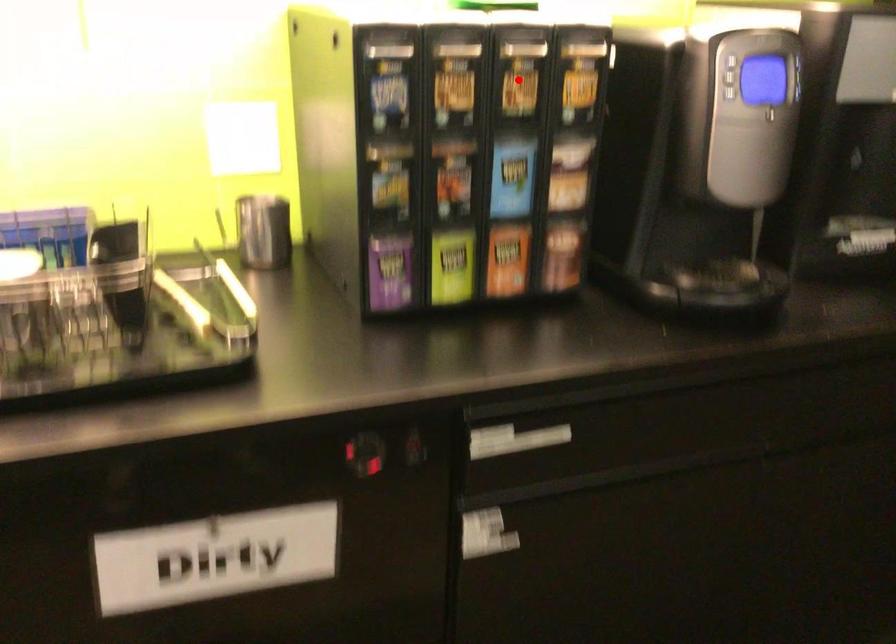
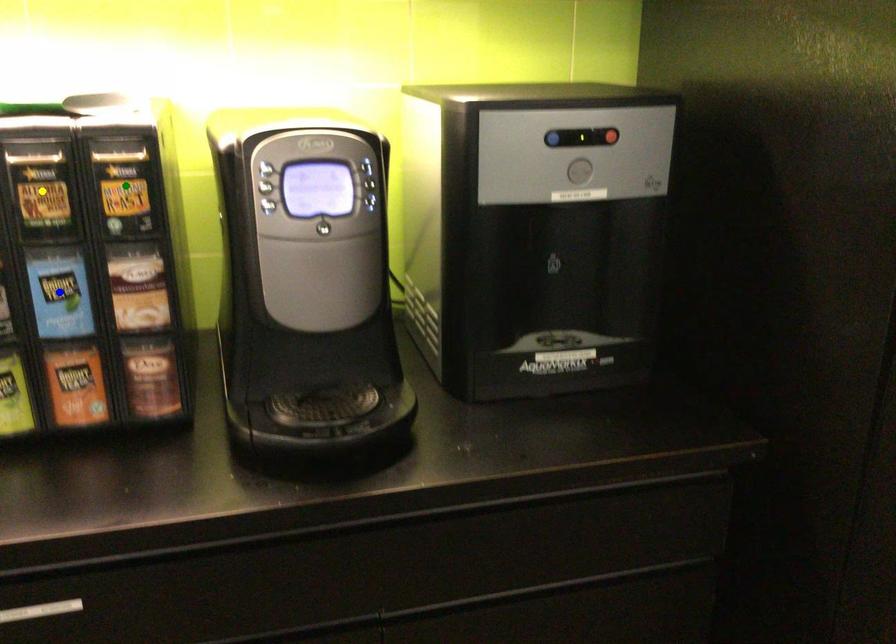
Question: I am providing you with two images of the same scene from different viewpoints. A red point is marked on the first image. You are given multiple points on the second image. Can you choose the point in image 2 that corresponds to the point in image 1?

Choices:
 (A) blue point
 (B) yellow point
 (C) green point

Answer: (B)